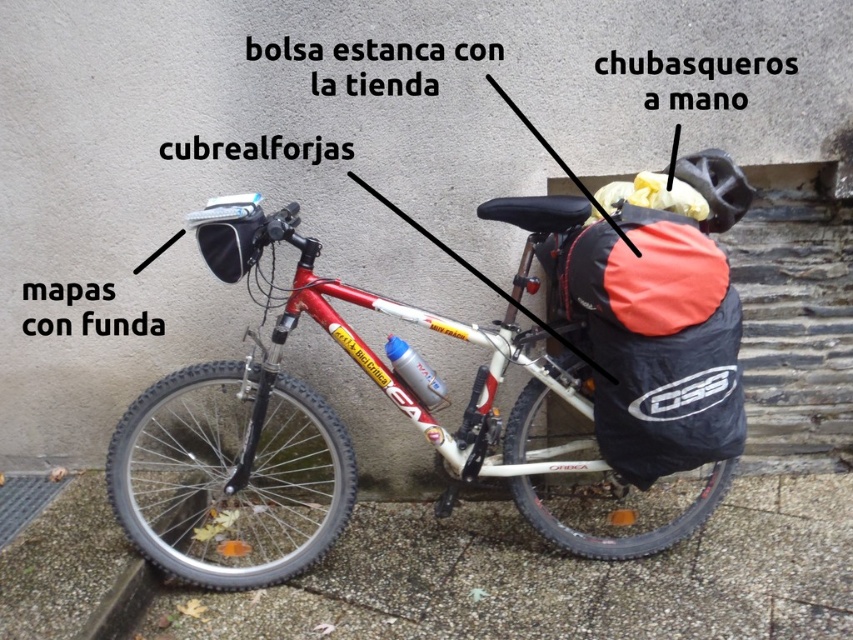
Question: Which object is the farthest from the shiny metallic bicycle at center?

Choices:
 (A) black/orange fabric bag at center-right
 (B) black matte helmet at upper right

Answer: (B)

Question: Which is farther from the shiny metallic bicycle at center?

Choices:
 (A) black/orange fabric bag at center-right
 (B) black matte helmet at upper right

Answer: (B)

Question: Is black/orange fabric bag at center-right to the right of black matte helmet at upper right from the viewer's perspective?

Choices:
 (A) yes
 (B) no

Answer: (B)

Question: Which object appears farthest from the camera in this image?

Choices:
 (A) black/orange fabric bag at center-right
 (B) black matte helmet at upper right
 (C) shiny metallic bicycle at center

Answer: (B)

Question: Is shiny metallic bicycle at center above black/orange fabric bag at center-right?

Choices:
 (A) no
 (B) yes

Answer: (A)

Question: Does shiny metallic bicycle at center appear over black/orange fabric bag at center-right?

Choices:
 (A) yes
 (B) no

Answer: (B)